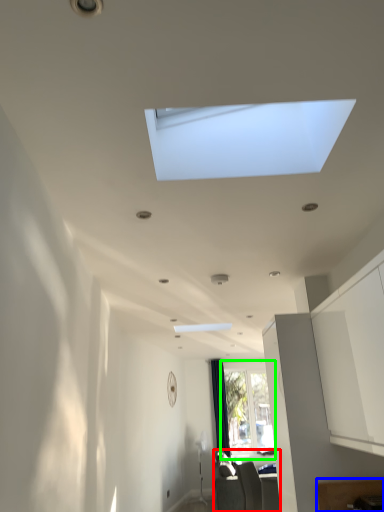
Question: Estimate the real-world distances between objects in this image. Which object is closer to furniture (highlighted by a red box), furniture (highlighted by a blue box) or window (highlighted by a green box)?

Choices:
 (A) furniture
 (B) window

Answer: (B)